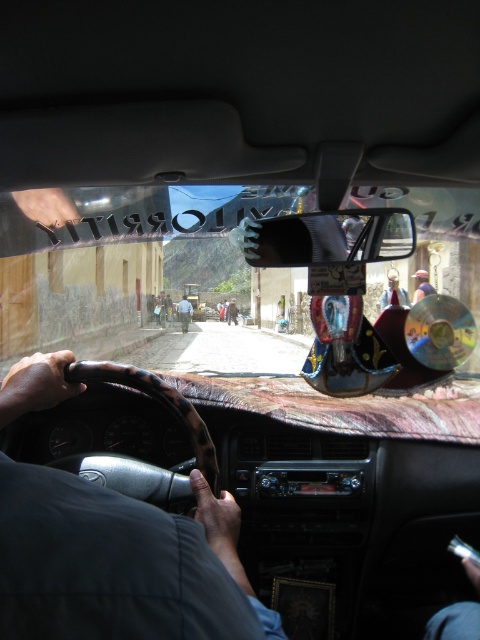
You are a passenger in a car and want to look at the road ahead. Which object, the matte glass windshield at center or the black leather steering wheel at center, allows you to see through it?

The matte glass windshield at center allows you to see through it because it is made of glass, while the black leather steering wheel at center is solid and does not allow visibility through it.

You are a passenger in the car and want to look at the street outside. Which object, the matte glass windshield at center or the light blue shirt at center, is positioned to your right side?

The matte glass windshield at center is to the right of the light blue shirt at center, so the matte glass windshield at center is positioned to your right side.

You are sitting in the driver seat of the vehicle. You see the point at coordinate (120,563). What object is located at that point?

The point at coordinate (120,563) corresponds to the black leather steering wheel at center.